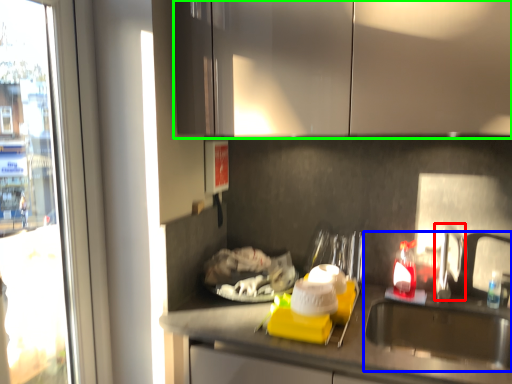
Question: Based on their relative distances, which object is nearer to faucet (highlighted by a red box)? Choose from sink (highlighted by a blue box) and cabinetry (highlighted by a green box).

Choices:
 (A) sink
 (B) cabinetry

Answer: (A)